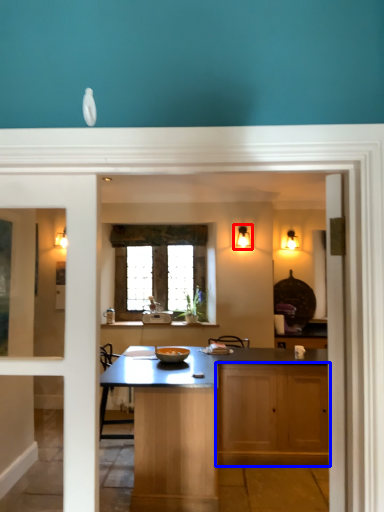
Question: Which object appears closest to the camera in this image, light fixture (highlighted by a red box) or cabinetry (highlighted by a blue box)?

Choices:
 (A) light fixture
 (B) cabinetry

Answer: (B)